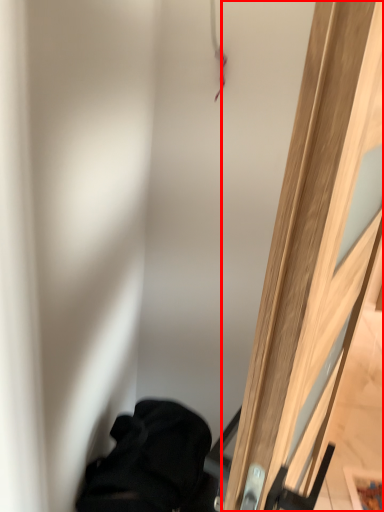
Question: From the image, what is the correct spatial relationship of door (annotated by the red box) in relation to furniture?

Choices:
 (A) right
 (B) left

Answer: (A)